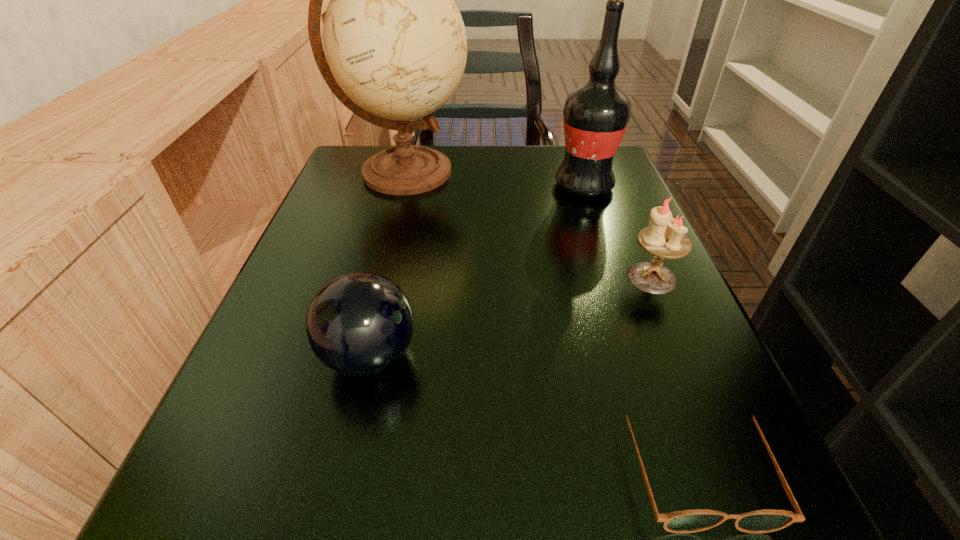
The image size is (960, 540). In order to click on object that is positioned at the far right corner in this screenshot , I will do `click(595, 116)`.

At what (x,y) coordinates should I click in order to perform the action: click on object present at the near right corner. Please return your answer as a coordinate pair (x, y). The height and width of the screenshot is (540, 960). Looking at the image, I should click on (687, 521).

Locate an element on the screen. vacant area at the far edge is located at coordinates (500, 154).

I want to click on free region at the near edge of the desktop, so click(x=421, y=488).

In the image, there is a desktop. At what (x,y) coordinates should I click in order to perform the action: click on vacant space at the left edge. Please return your answer as a coordinate pair (x, y). Image resolution: width=960 pixels, height=540 pixels. Looking at the image, I should click on (260, 429).

You are a GUI agent. You are given a task and a screenshot of the screen. Output one action in this format:
    pyautogui.click(x=<x>, y=<y>)
    Task: Click on the vacant space at the right edge of the desktop
    This screenshot has width=960, height=540.
    Given the screenshot: What is the action you would take?
    pyautogui.click(x=648, y=455)

The image size is (960, 540). I want to click on vacant position at the far left corner of the desktop, so click(x=366, y=198).

Find the location of `vacant region at the near left corner of the desktop`. vacant region at the near left corner of the desktop is located at coordinates (292, 527).

You are a GUI agent. You are given a task and a screenshot of the screen. Output one action in this format:
    pyautogui.click(x=<x>, y=<y>)
    Task: Click on the free location at the far right corner
    
    Given the screenshot: What is the action you would take?
    click(x=624, y=178)

The height and width of the screenshot is (540, 960). Find the location of `free space that is in between the third nearest object and the second shortest object`. free space that is in between the third nearest object and the second shortest object is located at coordinates (511, 317).